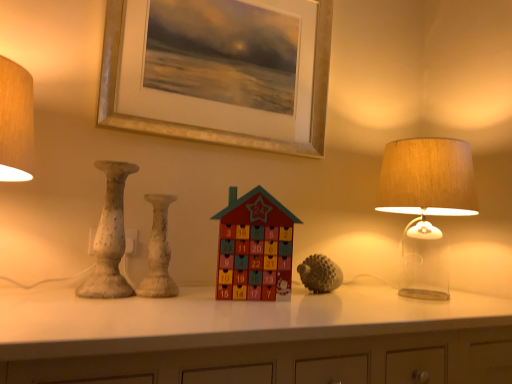
Question: Relative to translucent glass lampshade at right, is white speckled vase at center, placed as the first vase when sorted from right to left, in front or behind?

Choices:
 (A) behind
 (B) front

Answer: (B)

Question: In terms of size, does white speckled vase at center, placed as the first vase when sorted from right to left, appear bigger or smaller than translucent glass lampshade at right?

Choices:
 (A) small
 (B) big

Answer: (A)

Question: Estimate the real-world distances between objects in this image. Which object is farther from the white speckled vase at center, which appears as the second vase when viewed from the left?

Choices:
 (A) wooden advent calendar at center, the second toy from the right
 (B) textured gray hedgehog at center, positioned as the first toy in right-to-left order
 (C) translucent glass lampshade at right
 (D) speckled ceramic vase at left, marked as the 2th vase in a right-to-left arrangement
 (E) gold metallic picture frame at upper center

Answer: (C)

Question: Based on their relative distances, which object is farther from the wooden advent calendar at center, the second toy from the right?

Choices:
 (A) textured gray hedgehog at center, positioned as the second toy in front-to-back order
 (B) white speckled vase at center, which appears as the second vase when viewed from the left
 (C) speckled ceramic vase at left, positioned as the first vase in left-to-right order
 (D) translucent glass lampshade at right
 (E) gold metallic picture frame at upper center

Answer: (D)